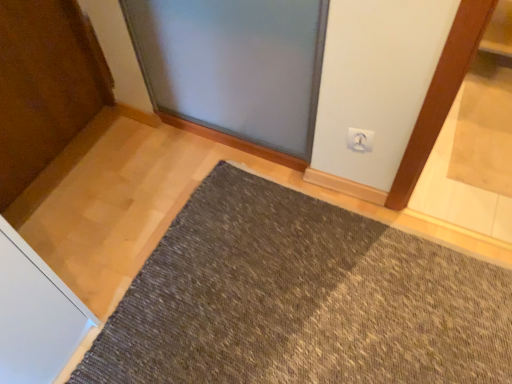
Question: From a real-world perspective, is dark gray textured mat at center located higher than white plastic electric outlet at upper right?

Choices:
 (A) yes
 (B) no

Answer: (B)

Question: Considering the relative sizes of dark gray textured mat at center and white plastic electric outlet at upper right in the image provided, is dark gray textured mat at center bigger than white plastic electric outlet at upper right?

Choices:
 (A) yes
 (B) no

Answer: (A)

Question: Is dark gray textured mat at center far away from white plastic electric outlet at upper right?

Choices:
 (A) yes
 (B) no

Answer: (B)

Question: Does dark gray textured mat at center come behind white plastic electric outlet at upper right?

Choices:
 (A) no
 (B) yes

Answer: (A)

Question: From the image's perspective, is dark gray textured mat at center located above white plastic electric outlet at upper right?

Choices:
 (A) no
 (B) yes

Answer: (A)

Question: Is white plastic electric outlet at upper right inside dark gray textured mat at center?

Choices:
 (A) yes
 (B) no

Answer: (B)

Question: From a real-world perspective, does white plastic electric outlet at upper right sit lower than dark gray textured mat at center?

Choices:
 (A) yes
 (B) no

Answer: (B)

Question: Does white plastic electric outlet at upper right turn towards dark gray textured mat at center?

Choices:
 (A) no
 (B) yes

Answer: (B)

Question: Can you confirm if white plastic electric outlet at upper right is shorter than dark gray textured mat at center?

Choices:
 (A) no
 (B) yes

Answer: (A)

Question: Is white plastic electric outlet at upper right outside dark gray textured mat at center?

Choices:
 (A) no
 (B) yes

Answer: (B)

Question: Can you confirm if white plastic electric outlet at upper right is positioned to the left of dark gray textured mat at center?

Choices:
 (A) yes
 (B) no

Answer: (B)

Question: Is white plastic electric outlet at upper right wider than dark gray textured mat at center?

Choices:
 (A) yes
 (B) no

Answer: (B)

Question: Choose the correct answer: Is dark gray textured mat at center inside white plastic electric outlet at upper right or outside it?

Choices:
 (A) outside
 (B) inside

Answer: (A)